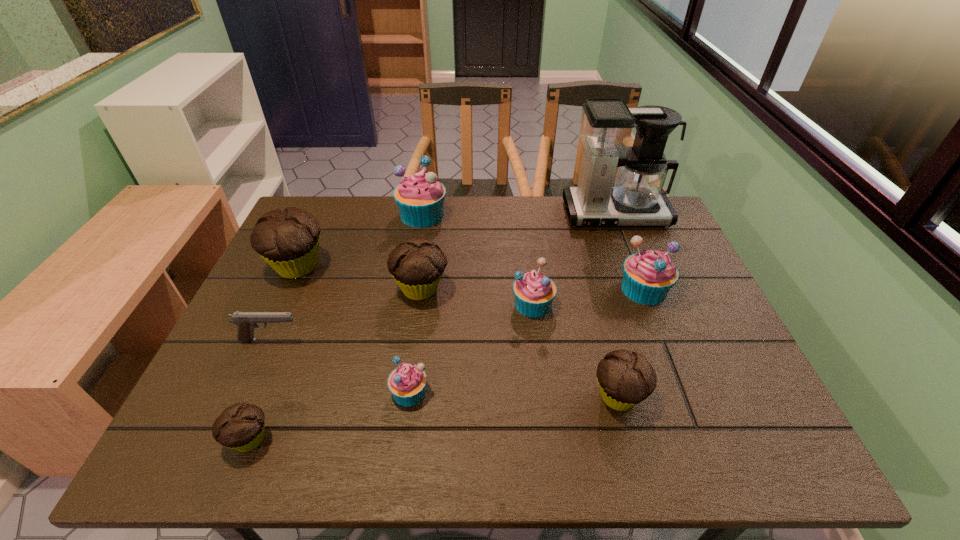
The width and height of the screenshot is (960, 540). I want to click on blank space located on the left of the third muffin from right to left, so click(x=361, y=304).

Find the location of `free point located on the left of the second muffin from right to left`. free point located on the left of the second muffin from right to left is located at coordinates (492, 397).

This screenshot has height=540, width=960. Find the location of `vacant region located at the barrel of the pistol`. vacant region located at the barrel of the pistol is located at coordinates (335, 340).

At what (x,y) coordinates should I click in order to perform the action: click on vacant space positioned 0.390m on the right of the nearest blue muffin. Please return your answer as a coordinate pair (x, y). This screenshot has height=540, width=960. Looking at the image, I should click on (610, 392).

The image size is (960, 540). Identify the location of vacant area situated on the right of the smallest chocolate muffin. (389, 440).

Identify the location of coffee maker located at the far edge. This screenshot has width=960, height=540. (607, 126).

Where is `muffin that is at the far edge`? This screenshot has height=540, width=960. muffin that is at the far edge is located at coordinates (420, 197).

Locate an element on the screen. The width and height of the screenshot is (960, 540). pistol that is at the left edge is located at coordinates (246, 321).

Locate an element on the screen. The height and width of the screenshot is (540, 960). coffee maker located in the right edge section of the desktop is located at coordinates (607, 126).

The height and width of the screenshot is (540, 960). Identify the location of muffin at the right edge. pos(648,276).